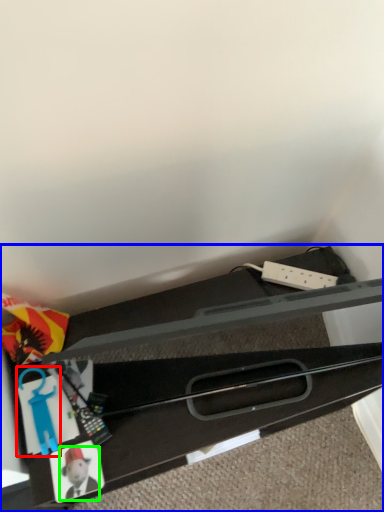
Question: Which is nearer to the toy (highlighted by a red box)? furniture (highlighted by a blue box) or toy (highlighted by a green box).

Choices:
 (A) furniture
 (B) toy

Answer: (B)